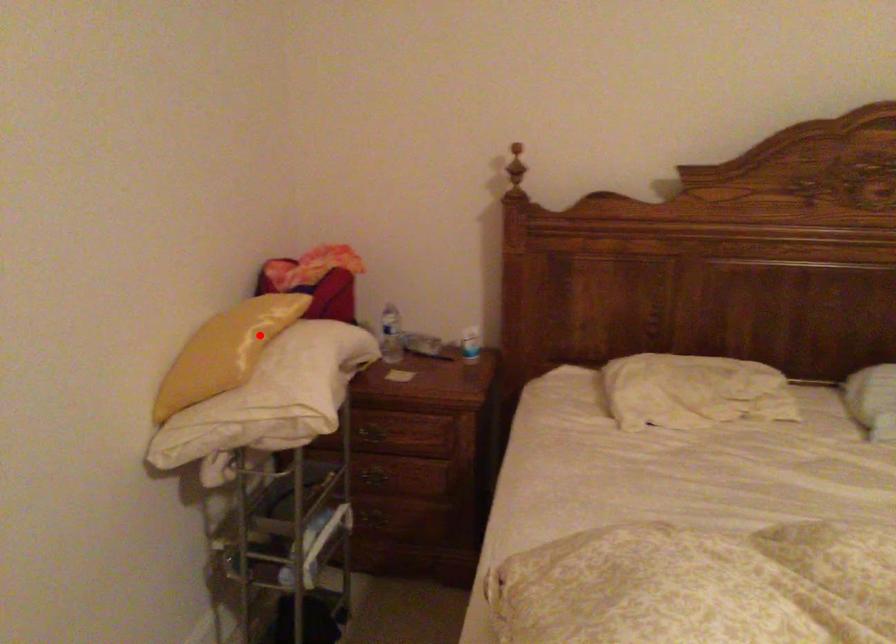
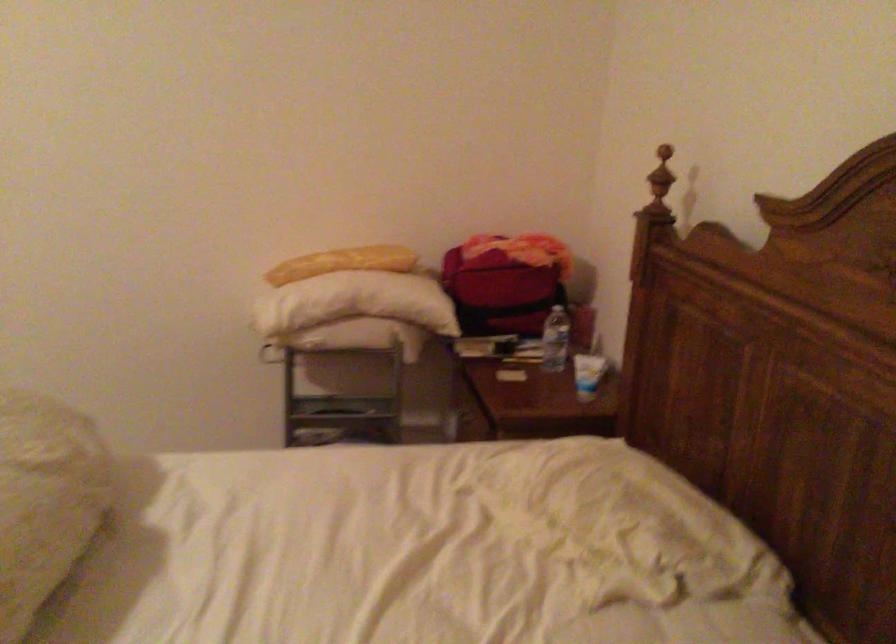
Locate, in the second image, the point that corresponds to the highlighted location in the first image.

(342, 263)